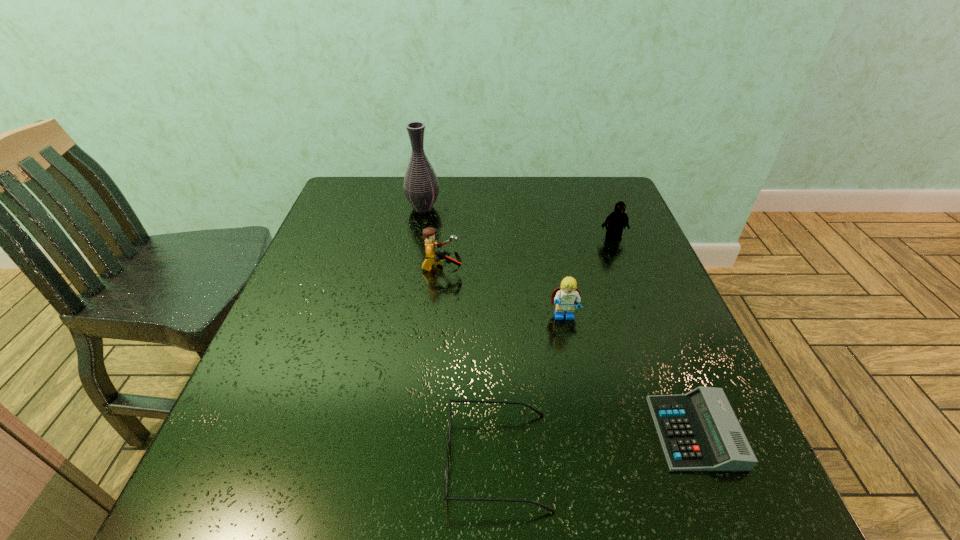
The width and height of the screenshot is (960, 540). In order to click on Lego positioned at the right edge in this screenshot , I will do `click(617, 220)`.

I want to click on calculator at the right edge, so click(x=699, y=431).

In the image, there is a desktop. Where is `vacant space at the far edge`? The width and height of the screenshot is (960, 540). vacant space at the far edge is located at coordinates (462, 212).

You are a GUI agent. You are given a task and a screenshot of the screen. Output one action in this format:
    pyautogui.click(x=<x>, y=<y>)
    Task: Click on the free space at the near edge
    The width and height of the screenshot is (960, 540).
    Given the screenshot: What is the action you would take?
    pyautogui.click(x=439, y=509)

In the image, there is a desktop. Where is `vacant space at the left edge`? The width and height of the screenshot is (960, 540). vacant space at the left edge is located at coordinates (361, 236).

Find the location of a particular element. This screenshot has width=960, height=540. free space at the far left corner is located at coordinates (348, 193).

Where is `free spot at the near right corner of the desktop`? This screenshot has width=960, height=540. free spot at the near right corner of the desktop is located at coordinates (732, 487).

You are a GUI agent. You are given a task and a screenshot of the screen. Output one action in this format:
    pyautogui.click(x=<x>, y=<y>)
    Task: Click on the unoccupied position between the shortest object and the fifth nearest object
    Image resolution: width=960 pixels, height=540 pixels.
    Given the screenshot: What is the action you would take?
    pyautogui.click(x=654, y=335)

Where is `vacant region between the second Lego from right to left and the third farthest object`? The height and width of the screenshot is (540, 960). vacant region between the second Lego from right to left and the third farthest object is located at coordinates (503, 293).

At what (x,y) coordinates should I click in order to perform the action: click on empty space that is in between the fourth nearest object and the rightmost Lego. Please return your answer as a coordinate pair (x, y). Looking at the image, I should click on (528, 253).